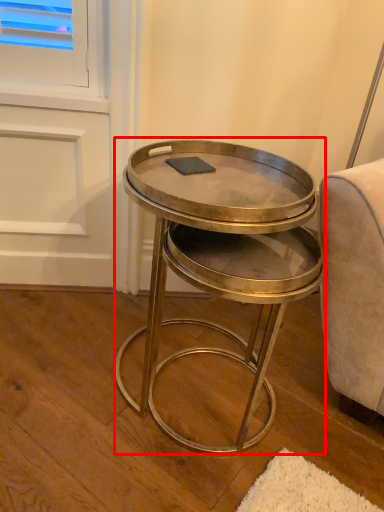
Question: From the image's perspective, what is the correct spatial relationship of coffee table (annotated by the red box) in relation to pad?

Choices:
 (A) below
 (B) above

Answer: (A)